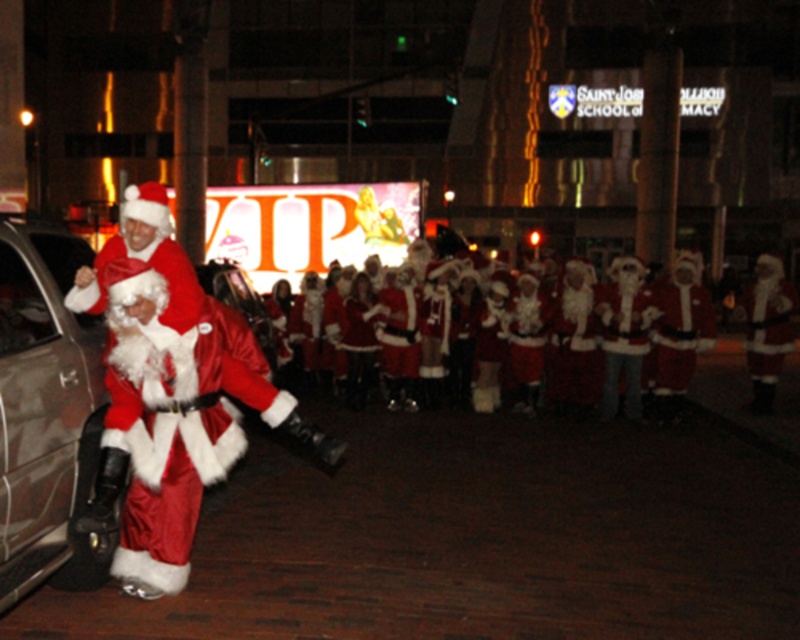
Question: Which of the following is the farthest from the observer?

Choices:
 (A) (216, 342)
 (B) (4, 220)

Answer: (A)

Question: Can you confirm if velvet red santa at left is positioned below metallic gray car at left?

Choices:
 (A) no
 (B) yes

Answer: (A)

Question: Which point is farther to the camera?

Choices:
 (A) velvet red santa at left
 (B) metallic gray car at left

Answer: (A)

Question: Can you confirm if velvet red santa at left is thinner than metallic gray car at left?

Choices:
 (A) yes
 (B) no

Answer: (B)

Question: Does velvet red santa at left have a smaller size compared to metallic gray car at left?

Choices:
 (A) no
 (B) yes

Answer: (A)